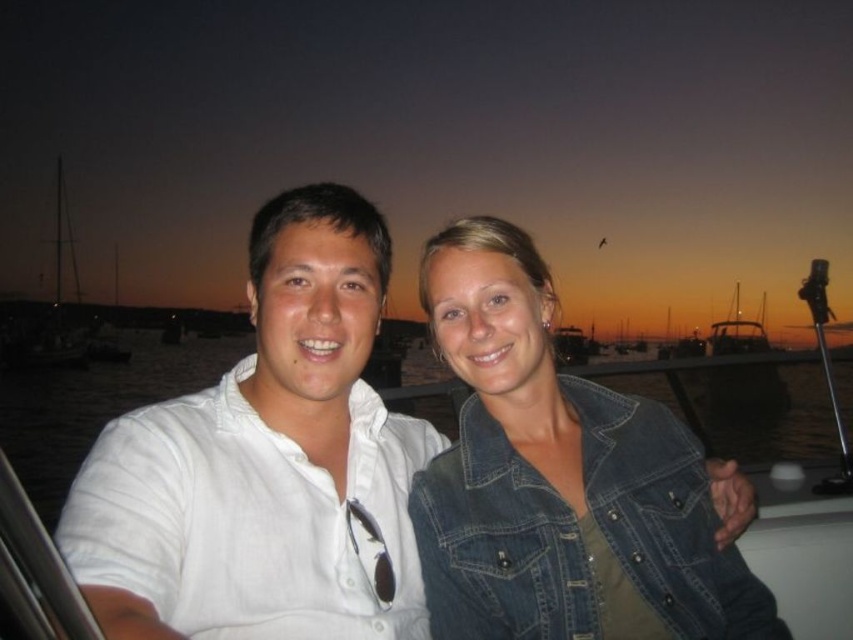
You are a photographer trying to capture the denim jacket at center in the image. Based on its coordinates, where should you aim your camera?

The denim jacket at center is located at coordinates point (560, 480), so aim your camera there to capture it.

You are a photographer trying to capture a closeup shot of both the white cotton shirt at center and the denim jacket at center. Since you want both to be clearly visible in the photo, which one should you focus on first to ensure the larger object is in focus?

The white cotton shirt at center is larger than the denim jacket at center, so you should focus on the white cotton shirt at center first to ensure it is in focus, then adjust for the denim jacket at center if needed.